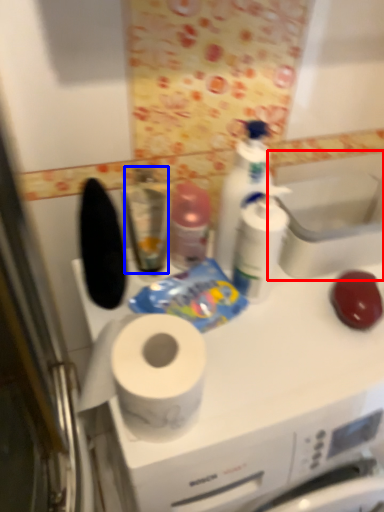
Question: Which of the following is the closest to the observer, sink (highlighted by a red box) or mouthwash (highlighted by a blue box)?

Choices:
 (A) sink
 (B) mouthwash

Answer: (B)